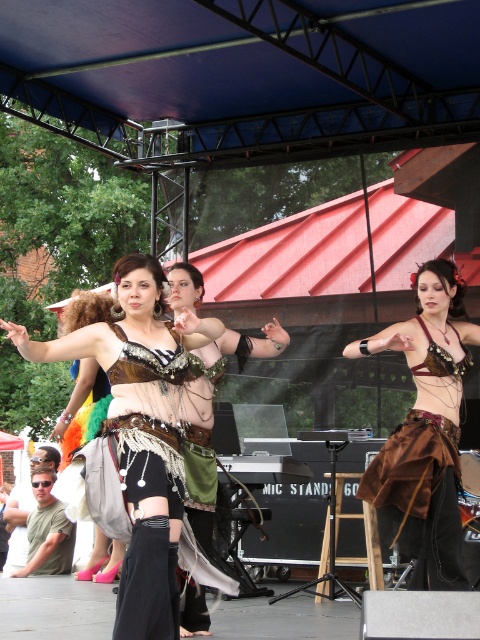
Question: Which object is positioned closest to the shiny silver belt at center?

Choices:
 (A) brown velvet skirt at center
 (B) shiny metallic bra at center

Answer: (B)

Question: Based on their relative distances, which object is nearer to the brown velvet skirt at center?

Choices:
 (A) shiny metallic bra at center
 (B) shiny silver belt at center

Answer: (A)

Question: Where is brown velvet skirt at center located in relation to shiny metallic bra at center in the image?

Choices:
 (A) left
 (B) right

Answer: (B)

Question: Does brown velvet skirt at center appear under shiny metallic bra at center?

Choices:
 (A) no
 (B) yes

Answer: (A)

Question: Is the position of brown velvet skirt at center less distant than that of shiny metallic bra at center?

Choices:
 (A) yes
 (B) no

Answer: (B)

Question: Which point is closer to the camera?

Choices:
 (A) pos(156,364)
 (B) pos(156,472)
 (C) pos(423,356)

Answer: (B)